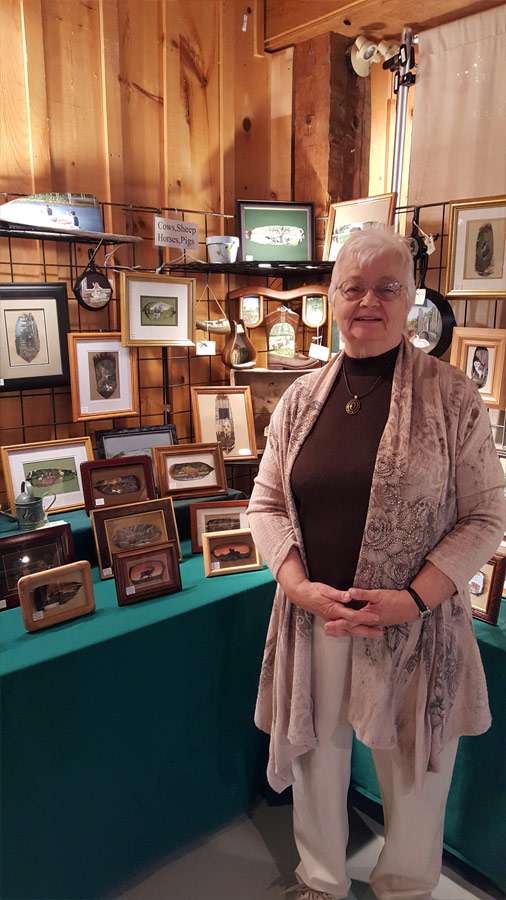
The width and height of the screenshot is (506, 900). In order to click on wall in this screenshot , I will do (x=201, y=122).